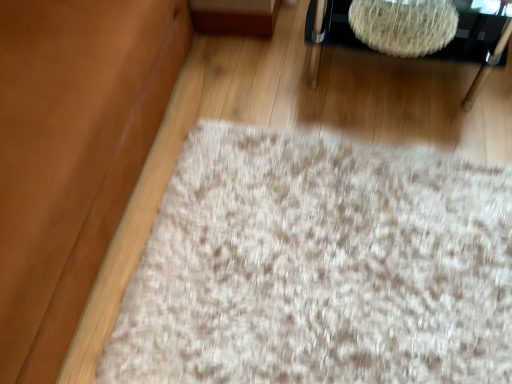
Question: Is white textured rug at upper right smaller than suede-like brown couch at lower left?

Choices:
 (A) no
 (B) yes

Answer: (B)

Question: Is white textured rug at upper right positioned before suede-like brown couch at lower left?

Choices:
 (A) yes
 (B) no

Answer: (B)

Question: Is white textured rug at upper right wider than suede-like brown couch at lower left?

Choices:
 (A) yes
 (B) no

Answer: (B)

Question: Is white textured rug at upper right at the left side of suede-like brown couch at lower left?

Choices:
 (A) yes
 (B) no

Answer: (B)

Question: Can you confirm if white textured rug at upper right is thinner than suede-like brown couch at lower left?

Choices:
 (A) yes
 (B) no

Answer: (A)

Question: From a real-world perspective, is white textured rug at upper right physically below suede-like brown couch at lower left?

Choices:
 (A) no
 (B) yes

Answer: (B)

Question: From a real-world perspective, is suede-like brown couch at lower left physically above white textured rug at upper right?

Choices:
 (A) no
 (B) yes

Answer: (B)

Question: Is suede-like brown couch at lower left bigger than white textured rug at upper right?

Choices:
 (A) no
 (B) yes

Answer: (B)

Question: Would you say suede-like brown couch at lower left is outside white textured rug at upper right?

Choices:
 (A) yes
 (B) no

Answer: (A)

Question: From a real-world perspective, is suede-like brown couch at lower left positioned under white textured rug at upper right based on gravity?

Choices:
 (A) yes
 (B) no

Answer: (B)

Question: From the image's perspective, would you say suede-like brown couch at lower left is shown under white textured rug at upper right?

Choices:
 (A) yes
 (B) no

Answer: (A)

Question: Can you confirm if suede-like brown couch at lower left is positioned to the right of white textured rug at upper right?

Choices:
 (A) yes
 (B) no

Answer: (B)

Question: From the image's perspective, relative to white textured rug at upper right, is suede-like brown couch at lower left above or below?

Choices:
 (A) below
 (B) above

Answer: (A)